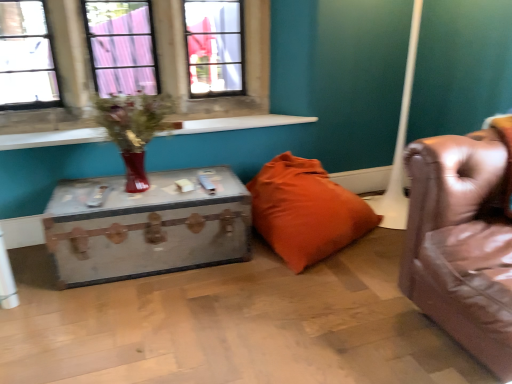
The height and width of the screenshot is (384, 512). Describe the element at coordinates (133, 129) in the screenshot. I see `matte glass vase at upper left` at that location.

Describe the element at coordinates (146, 227) in the screenshot. I see `rustic wood trunk at center` at that location.

This screenshot has height=384, width=512. In order to click on rustic wood trunk at center in this screenshot , I will do `click(146, 227)`.

What do you see at coordinates (306, 211) in the screenshot?
I see `orange fabric pillow at center` at bounding box center [306, 211].

Where is `matte glass vase at upper left`? Image resolution: width=512 pixels, height=384 pixels. matte glass vase at upper left is located at coordinates (133, 129).

Is matte glass vase at upper left aimed at white smooth window sill at upper left?

No, matte glass vase at upper left is not oriented towards white smooth window sill at upper left.

Considering the positions of objects matte glass vase at upper left and white smooth window sill at upper left in the image provided, who is more to the left, matte glass vase at upper left or white smooth window sill at upper left?

From the viewer's perspective, matte glass vase at upper left appears more on the left side.

Is matte glass vase at upper left behind white smooth window sill at upper left?

No, the depth of matte glass vase at upper left is less than that of white smooth window sill at upper left.

Is orange fabric pillow at center at the back of rustic wood trunk at center?

rustic wood trunk at center does not have its back to orange fabric pillow at center.

From a real-world perspective, is rustic wood trunk at center physically located above or below orange fabric pillow at center?

rustic wood trunk at center is below orange fabric pillow at center.

Measure the distance from rustic wood trunk at center to orange fabric pillow at center.

rustic wood trunk at center is 18.72 inches from orange fabric pillow at center.

The width and height of the screenshot is (512, 384). What are the coordinates of `pillow located above the rustic wood trunk at center (from a real-world perspective)` in the screenshot? It's located at (306, 211).

Between orange fabric pillow at center and rustic wood trunk at center, which one has larger width?

Wider between the two is orange fabric pillow at center.

Considering the relative positions of orange fabric pillow at center and rustic wood trunk at center in the image provided, is orange fabric pillow at center in front of rustic wood trunk at center?

No, it is behind rustic wood trunk at center.

Considering the sizes of objects orange fabric pillow at center and rustic wood trunk at center in the image provided, who is taller, orange fabric pillow at center or rustic wood trunk at center?

orange fabric pillow at center is taller.

Which of these two, orange fabric pillow at center or rustic wood trunk at center, is bigger?

Bigger between the two is orange fabric pillow at center.

From the image's perspective, is rustic wood trunk at center above or below white smooth window sill at upper left?

Based on their image positions, rustic wood trunk at center is located beneath white smooth window sill at upper left.

Consider the image. Is the position of rustic wood trunk at center more distant than that of white smooth window sill at upper left?

No, rustic wood trunk at center is closer to the viewer.

How many degrees apart are the facing directions of rustic wood trunk at center and white smooth window sill at upper left?

The angle between the facing direction of rustic wood trunk at center and the facing direction of white smooth window sill at upper left is 1.15 degrees.

Are rustic wood trunk at center and white smooth window sill at upper left making contact?

There is a gap between rustic wood trunk at center and white smooth window sill at upper left.

Considering the sizes of objects white smooth window sill at upper left and matte glass vase at upper left in the image provided, who is wider, white smooth window sill at upper left or matte glass vase at upper left?

Wider between the two is matte glass vase at upper left.

From a real-world perspective, which is physically below, white smooth window sill at upper left or matte glass vase at upper left?

white smooth window sill at upper left, from a real-world perspective.

From the image's perspective, is white smooth window sill at upper left over matte glass vase at upper left?

Yes.

In the image, is white smooth window sill at upper left on the left side or the right side of matte glass vase at upper left?

white smooth window sill at upper left is to the right of matte glass vase at upper left.

I want to click on window sill above the orange fabric pillow at center (from the image's perspective), so click(x=237, y=123).

Considering the positions of objects orange fabric pillow at center and white smooth window sill at upper left in the image provided, who is behind, orange fabric pillow at center or white smooth window sill at upper left?

white smooth window sill at upper left.

In the scene shown: Does orange fabric pillow at center have a lesser height compared to white smooth window sill at upper left?

In fact, orange fabric pillow at center may be taller than white smooth window sill at upper left.

Can you confirm if orange fabric pillow at center is taller than matte glass vase at upper left?

Correct, orange fabric pillow at center is much taller as matte glass vase at upper left.

Looking at this image, measure the distance between orange fabric pillow at center and matte glass vase at upper left.

orange fabric pillow at center is 30.69 inches away from matte glass vase at upper left.

Looking at their sizes, would you say orange fabric pillow at center is wider or thinner than matte glass vase at upper left?

orange fabric pillow at center is wider than matte glass vase at upper left.

Where is `floral arrangement located above the orange fabric pillow at center (from the image's perspective)`? Image resolution: width=512 pixels, height=384 pixels. floral arrangement located above the orange fabric pillow at center (from the image's perspective) is located at coordinates (133, 129).

Locate an element on the screen. This screenshot has width=512, height=384. floral arrangement above the white smooth window sill at upper left (from a real-world perspective) is located at coordinates (133, 129).

The image size is (512, 384). I want to click on pillow behind the rustic wood trunk at center, so click(306, 211).

Looking at the image, which one is located closer to rustic wood trunk at center, matte glass vase at upper left or white smooth window sill at upper left?

Among the two, matte glass vase at upper left is located nearer to rustic wood trunk at center.

Estimate the real-world distances between objects in this image. Which object is closer to orange fabric pillow at center, rustic wood trunk at center or matte glass vase at upper left?

Among the two, rustic wood trunk at center is located nearer to orange fabric pillow at center.

From the picture: Looking at the image, which one is located further to orange fabric pillow at center, matte glass vase at upper left or rustic wood trunk at center?

matte glass vase at upper left.

Considering their positions, is matte glass vase at upper left positioned closer to orange fabric pillow at center than white smooth window sill at upper left?

white smooth window sill at upper left is positioned closer to the anchor orange fabric pillow at center.

From the image, which object appears to be nearer to matte glass vase at upper left, rustic wood trunk at center or white smooth window sill at upper left?

rustic wood trunk at center is closer to matte glass vase at upper left.

Based on their spatial positions, is rustic wood trunk at center or orange fabric pillow at center further from matte glass vase at upper left?

orange fabric pillow at center.

Looking at the image, which one is located closer to rustic wood trunk at center, orange fabric pillow at center or white smooth window sill at upper left?

Among the two, orange fabric pillow at center is located nearer to rustic wood trunk at center.

Looking at the image, which one is located closer to matte glass vase at upper left, white smooth window sill at upper left or orange fabric pillow at center?

white smooth window sill at upper left is closer to matte glass vase at upper left.

Find the location of a particular element. Image resolution: width=512 pixels, height=384 pixels. window sill between matte glass vase at upper left and orange fabric pillow at center is located at coordinates (237, 123).

You are a GUI agent. You are given a task and a screenshot of the screen. Output one action in this format:
    pyautogui.click(x=<x>, y=<y>)
    Task: Click on the table between matte glass vase at upper left and orange fabric pillow at center
    
    Given the screenshot: What is the action you would take?
    pyautogui.click(x=146, y=227)

At what (x,y) coordinates should I click in order to perform the action: click on floral arrangement that lies between white smooth window sill at upper left and rustic wood trunk at center from top to bottom. Please return your answer as a coordinate pair (x, y). This screenshot has width=512, height=384. Looking at the image, I should click on (133, 129).

Locate an element on the screen. This screenshot has width=512, height=384. window sill between rustic wood trunk at center and orange fabric pillow at center from left to right is located at coordinates (237, 123).